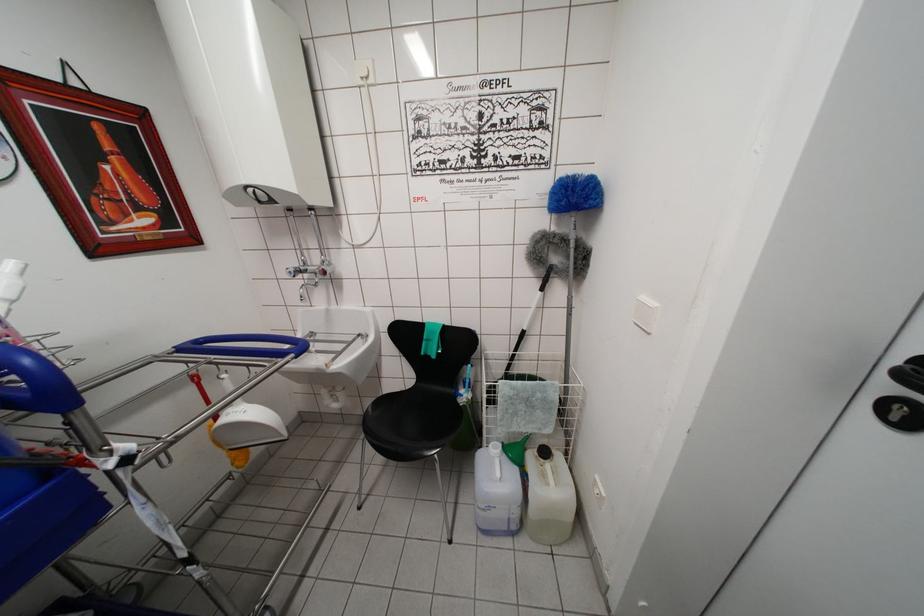
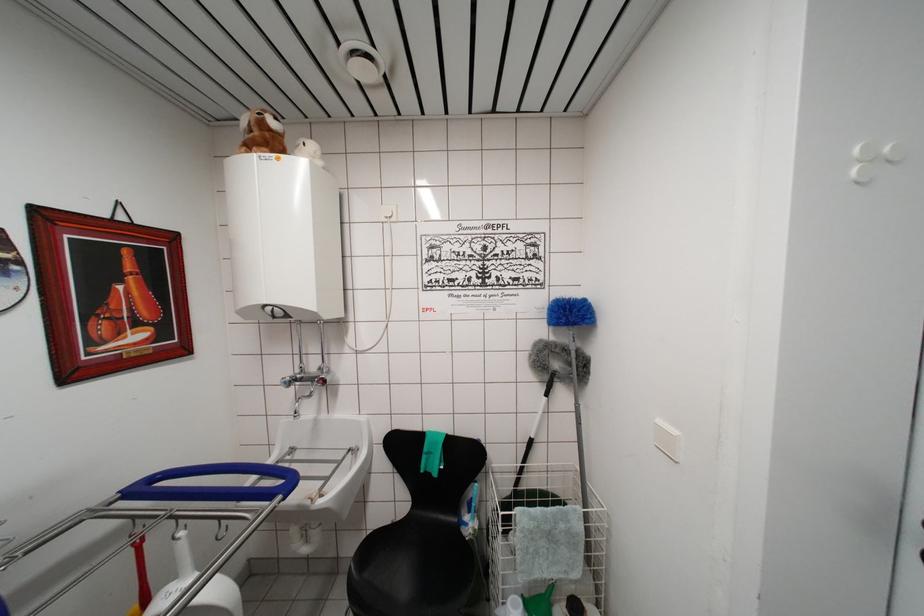
Question: The images are taken continuously from a first-person perspective. In which direction are you moving?

Choices:
 (A) Left
 (B) Right
 (C) Forward
 (D) Backward

Answer: (A)